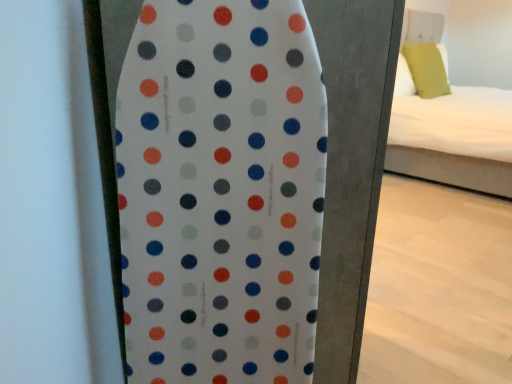
Question: Does white dotted surfboard at center have a lesser width compared to white fabric bed at right?

Choices:
 (A) yes
 (B) no

Answer: (A)

Question: Does white dotted surfboard at center lie behind white fabric bed at right?

Choices:
 (A) no
 (B) yes

Answer: (A)

Question: From the image's perspective, would you say white dotted surfboard at center is shown under white fabric bed at right?

Choices:
 (A) yes
 (B) no

Answer: (A)

Question: Is white dotted surfboard at center in contact with white fabric bed at right?

Choices:
 (A) yes
 (B) no

Answer: (B)

Question: Can you confirm if white dotted surfboard at center is smaller than white fabric bed at right?

Choices:
 (A) no
 (B) yes

Answer: (B)

Question: Considering the relative positions of white dotted surfboard at center and white fabric bed at right in the image provided, is white dotted surfboard at center in front of white fabric bed at right?

Choices:
 (A) yes
 (B) no

Answer: (A)

Question: Is white fabric bed at right next to green fabric pillow at upper right and touching it?

Choices:
 (A) no
 (B) yes

Answer: (A)

Question: Considering the relative positions of white fabric bed at right and green fabric pillow at upper right in the image provided, is white fabric bed at right to the left of green fabric pillow at upper right from the viewer's perspective?

Choices:
 (A) no
 (B) yes

Answer: (A)

Question: Is white fabric bed at right facing away from green fabric pillow at upper right?

Choices:
 (A) no
 (B) yes

Answer: (B)

Question: Does white fabric bed at right have a smaller size compared to green fabric pillow at upper right?

Choices:
 (A) no
 (B) yes

Answer: (A)

Question: Is green fabric pillow at upper right inside white fabric bed at right?

Choices:
 (A) yes
 (B) no

Answer: (A)

Question: Could you tell me if white fabric bed at right is facing green fabric pillow at upper right?

Choices:
 (A) no
 (B) yes

Answer: (B)

Question: Is white fabric bed at right wider than white dotted surfboard at center?

Choices:
 (A) no
 (B) yes

Answer: (B)